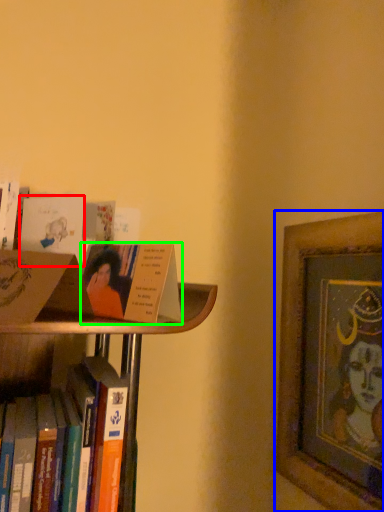
Question: Based on their relative distances, which object is farther from paperback book (highlighted by a red box)? Choose from picture frame (highlighted by a blue box) and book (highlighted by a green box).

Choices:
 (A) picture frame
 (B) book

Answer: (A)